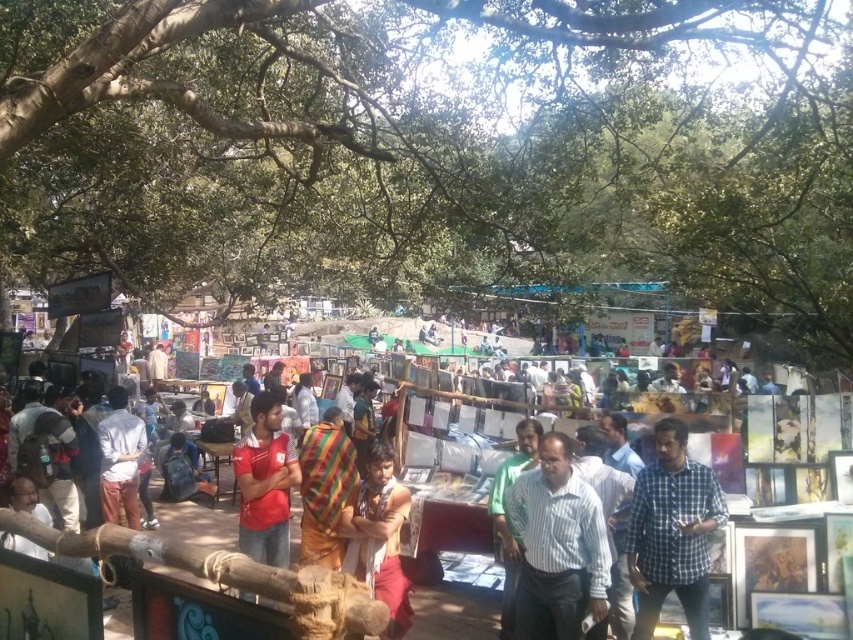
You are a vendor at the outdoor art fair and need to hang two shirts on a single hanger. The striped cotton shirt at center and the red cotton shirt at center. Can you fit both on the hanger if the hanger can only hold a total width of 1 meter?

The striped cotton shirt at center might be wider than red cotton shirt at center, so if the striped cotton shirt at center exceeds 0.5 meters in width, the total combined width could exceed 1 meter. Therefore, it depends on the exact widths of both shirts.